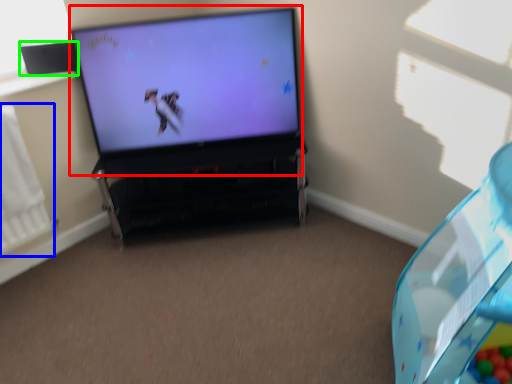
Question: Which is farther away from television (highlighted by a red box)? radiator (highlighted by a blue box) or speaker (highlighted by a green box)?

Choices:
 (A) radiator
 (B) speaker

Answer: (A)